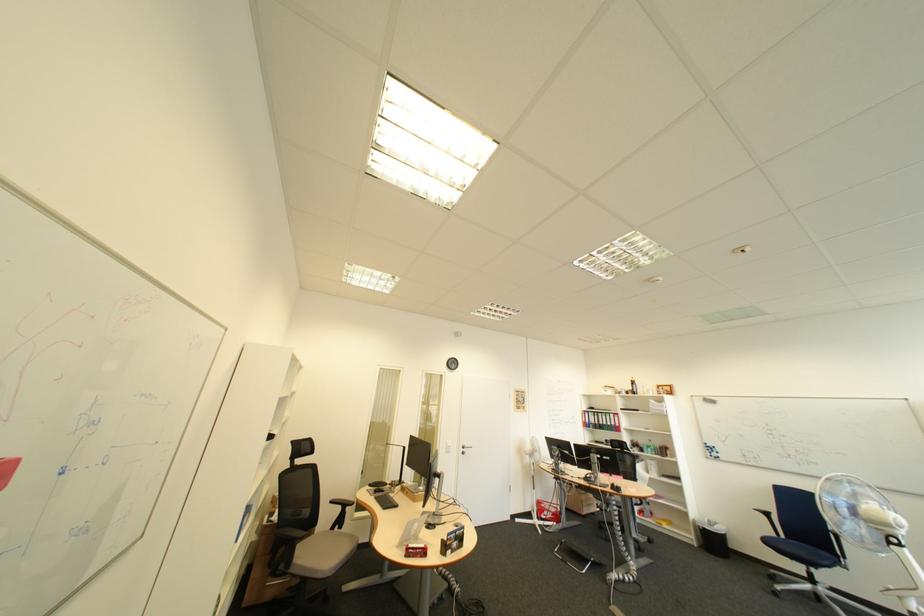
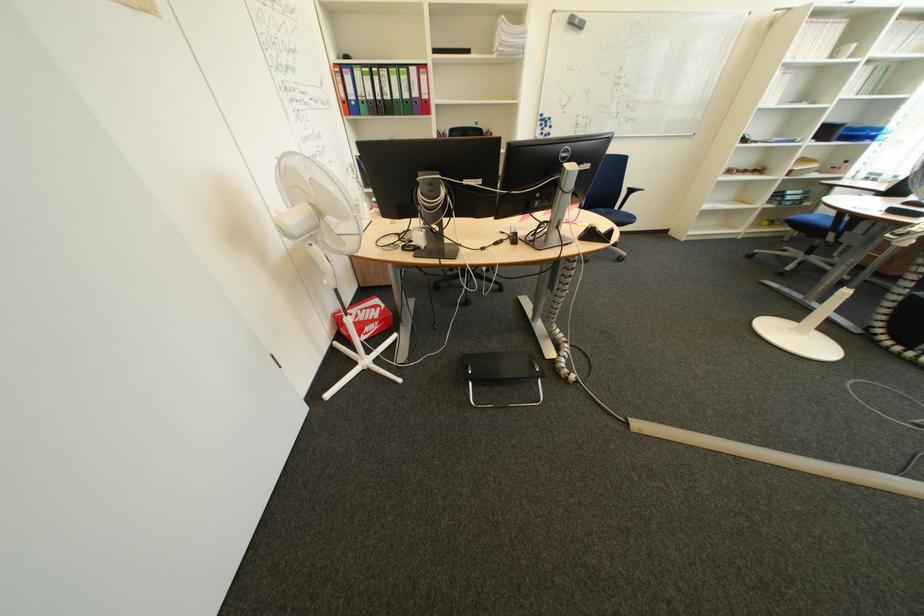
Find the pixel in the second image that matches (x=562, y=514) in the first image.

(385, 326)